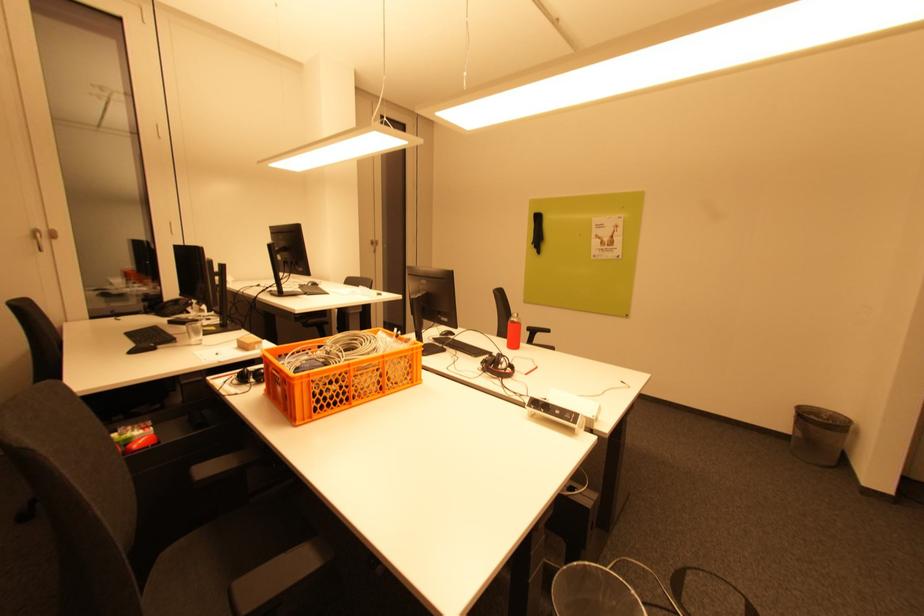
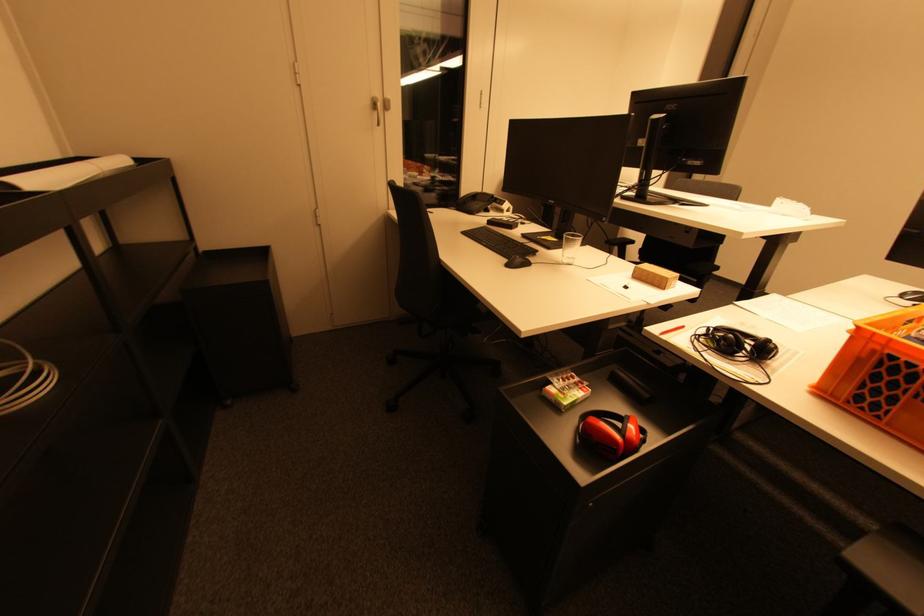
Question: In a continuous first-person perspective shot, in which direction is the camera moving?

Choices:
 (A) Left
 (B) Right
 (C) Forward
 (D) Backward

Answer: (A)